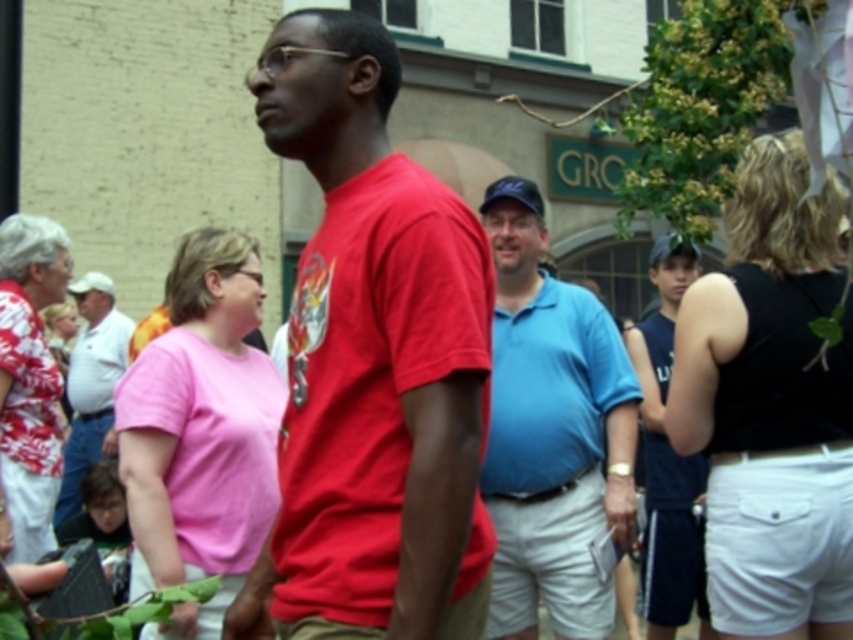
Question: Which object is positioned closest to the pink matte shirt at center?

Choices:
 (A) pink fabric shirt at left
 (B) blue cotton shirt at center
 (C) hawaiian print blouse at left

Answer: (B)

Question: Estimate the real-world distances between objects in this image. Which object is farther from the pink fabric shirt at left?

Choices:
 (A) pink matte shirt at center
 (B) blue cotton shirt at center

Answer: (B)

Question: Which point appears farthest from the camera in this image?

Choices:
 (A) (260, 392)
 (B) (569, 515)
 (C) (646, 502)

Answer: (C)

Question: Is matte red t-shirt at center above white cotton shorts at right?

Choices:
 (A) yes
 (B) no

Answer: (A)

Question: Does matte red t-shirt at center have a greater width compared to blue cotton shirt at center?

Choices:
 (A) no
 (B) yes

Answer: (B)

Question: Does white cotton shorts at right appear on the right side of blue cotton shirt at center?

Choices:
 (A) yes
 (B) no

Answer: (A)